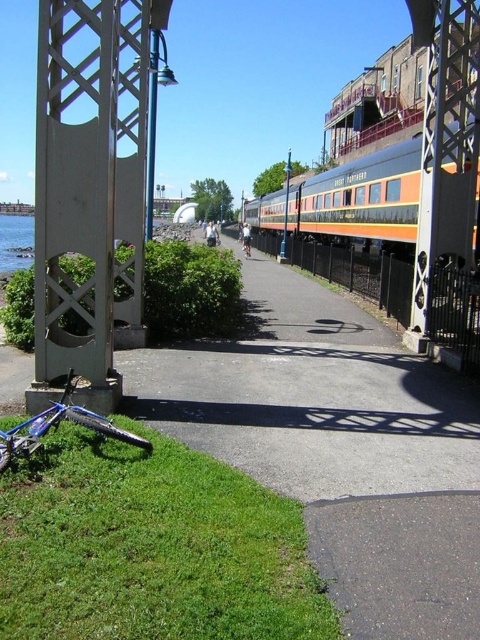
Question: Where is green grass at lower left located in relation to blue metallic bicycle at lower left in the image?

Choices:
 (A) below
 (B) above

Answer: (A)

Question: Estimate the real-world distances between objects in this image. Which object is closer to the blue metallic bicycle at lower left?

Choices:
 (A) blue matte bicycle at center
 (B) orange polished wood passenger train at center
 (C) green grass at lower left

Answer: (C)

Question: Can you confirm if orange polished wood passenger train at center is thinner than blue matte bicycle at center?

Choices:
 (A) no
 (B) yes

Answer: (A)

Question: Which of the following is the closest to the observer?

Choices:
 (A) blue metallic bicycle at lower left
 (B) blue matte bicycle at center

Answer: (A)

Question: Can you confirm if orange polished wood passenger train at center is positioned to the left of blue metallic bicycle at lower left?

Choices:
 (A) no
 (B) yes

Answer: (A)

Question: Which point appears closest to the camera in this image?

Choices:
 (A) (245, 256)
 (B) (12, 234)
 (C) (144, 440)
 (D) (383, 234)

Answer: (C)